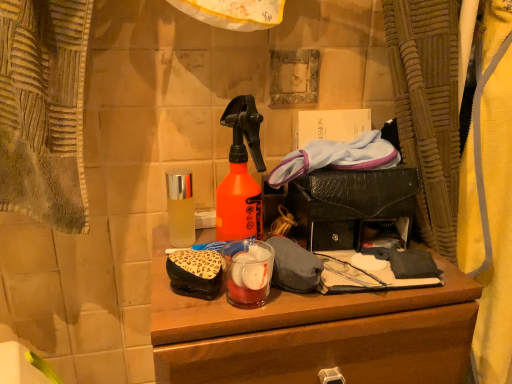
I want to click on empty space that is ontop of wooden desk at center (from a real-world perspective), so click(x=327, y=280).